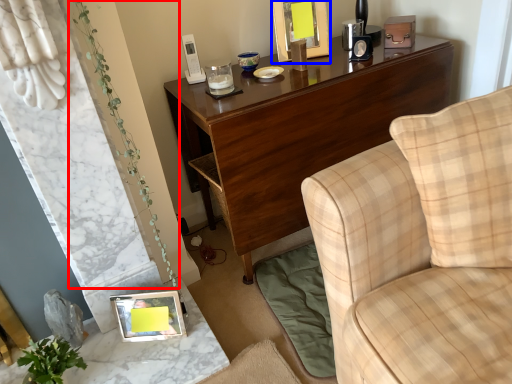
Question: Which object appears closest to the camera in this image, plant (highlighted by a red box) or picture frame (highlighted by a blue box)?

Choices:
 (A) plant
 (B) picture frame

Answer: (A)